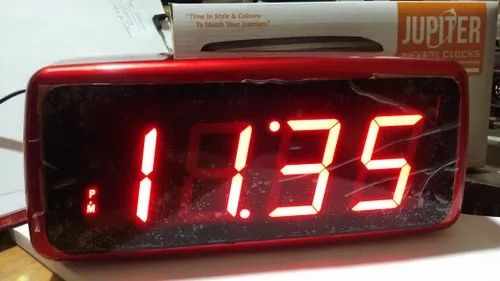
Where is `cardboard box`? cardboard box is located at coordinates (281, 9).